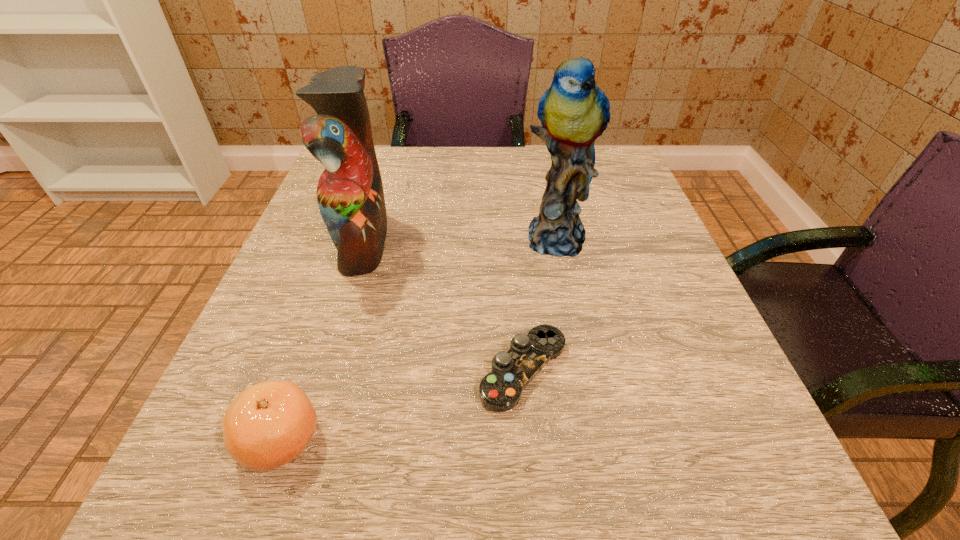
Image resolution: width=960 pixels, height=540 pixels. In order to click on free space that is in between the clementine and the shortest object in this screenshot , I will do click(x=402, y=405).

This screenshot has width=960, height=540. I want to click on vacant region between the control and the clementine, so click(x=402, y=405).

Find the location of a particular element. This screenshot has width=960, height=540. free space between the tallest object and the shorter parrot is located at coordinates (460, 239).

Identify the location of free space between the control and the left parrot. (444, 306).

Where is `free space between the third tallest object and the third shortest object`? free space between the third tallest object and the third shortest object is located at coordinates (322, 341).

This screenshot has width=960, height=540. I want to click on vacant space in between the third tallest object and the second tallest object, so (x=322, y=341).

The width and height of the screenshot is (960, 540). I want to click on free spot between the clementine and the left parrot, so click(x=322, y=341).

Identify the location of unoccupied area between the control and the third tallest object. (402, 405).

Identify which object is the closest to the taller parrot. Please provide its 2D coordinates. Your answer should be formatted as a tuple, i.e. [(x, y)], where the tuple contains the x and y coordinates of a point satisfying the conditions above.

[(500, 390)]

Locate an element on the screen. This screenshot has width=960, height=540. the second closest object to the clementine is located at coordinates (350, 196).